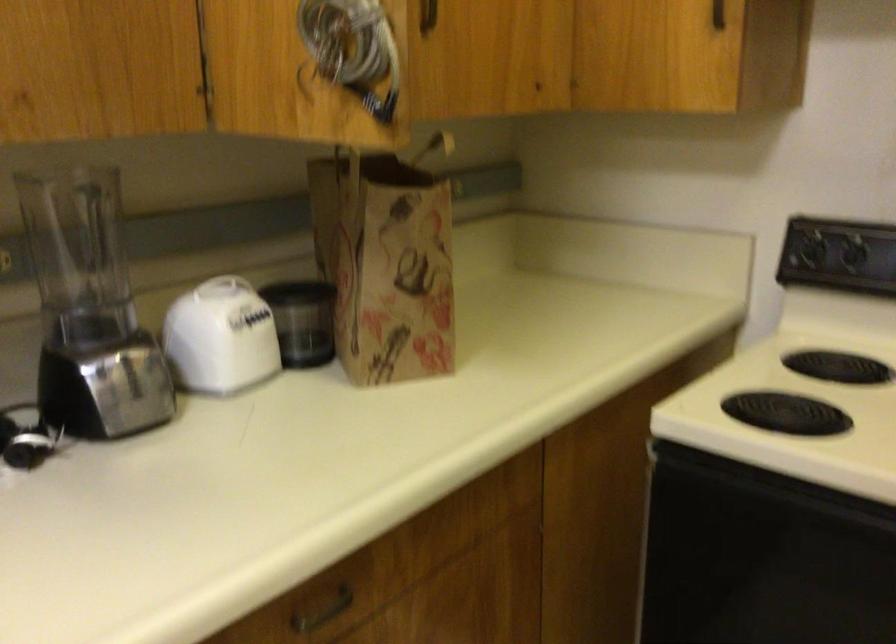
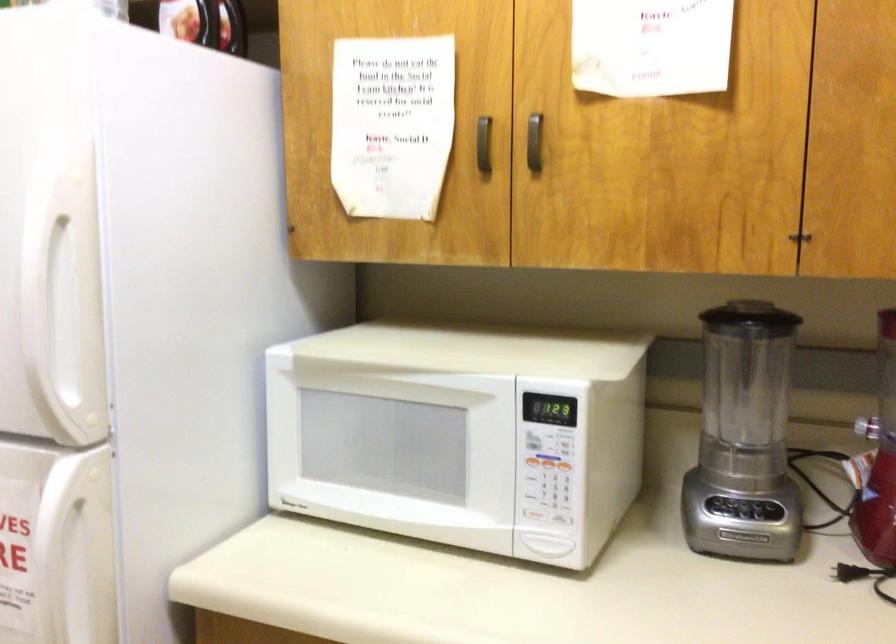
Question: The camera is either moving clockwise (left) or counter-clockwise (right) around the object. The first image is from the beginning of the video and the second image is from the end. Is the camera moving left or right when shooting the video?

Choices:
 (A) Left
 (B) Right

Answer: (B)